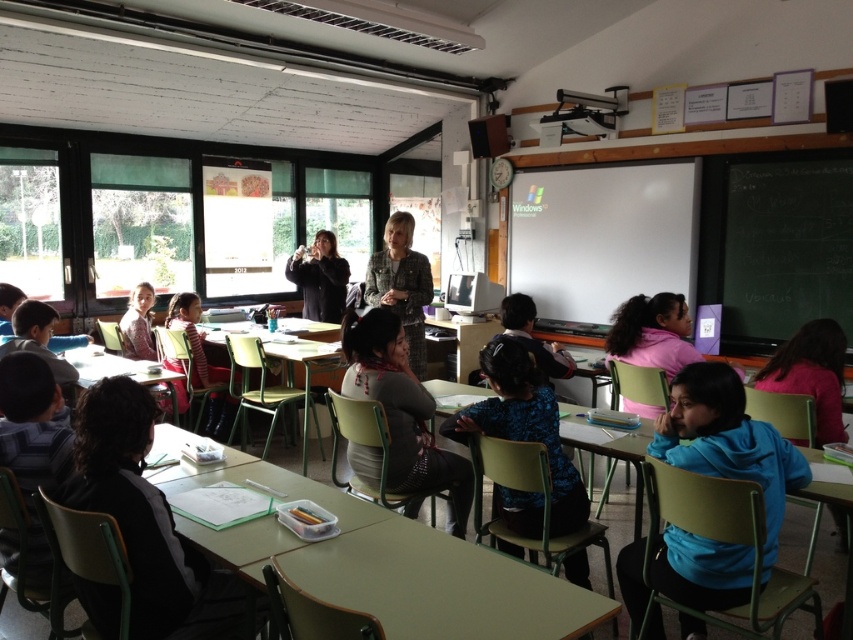
Question: Can you confirm if dark gray sweater at center is positioned below patterned fabric jacket at center?

Choices:
 (A) no
 (B) yes

Answer: (B)

Question: Does white matte projector screen at upper right appear over green plastic table at lower left?

Choices:
 (A) no
 (B) yes

Answer: (B)

Question: Observing the image, what is the correct spatial positioning of blue fleece jacket at lower right in reference to blue fabric shirt at center?

Choices:
 (A) above
 (B) below

Answer: (B)

Question: Which object appears closest to the camera in this image?

Choices:
 (A) dark gray sweater at center
 (B) blue fleece jacket at lower right
 (C) white matte projector screen at upper right
 (D) blackboard at right

Answer: (B)

Question: Which point is closer to the camera?

Choices:
 (A) (347, 387)
 (B) (289, 369)
 (C) (792, 301)
 (D) (409, 307)

Answer: (A)

Question: Which point appears closest to the camera in this image?

Choices:
 (A) (531, 435)
 (B) (772, 532)
 (C) (715, 186)

Answer: (B)